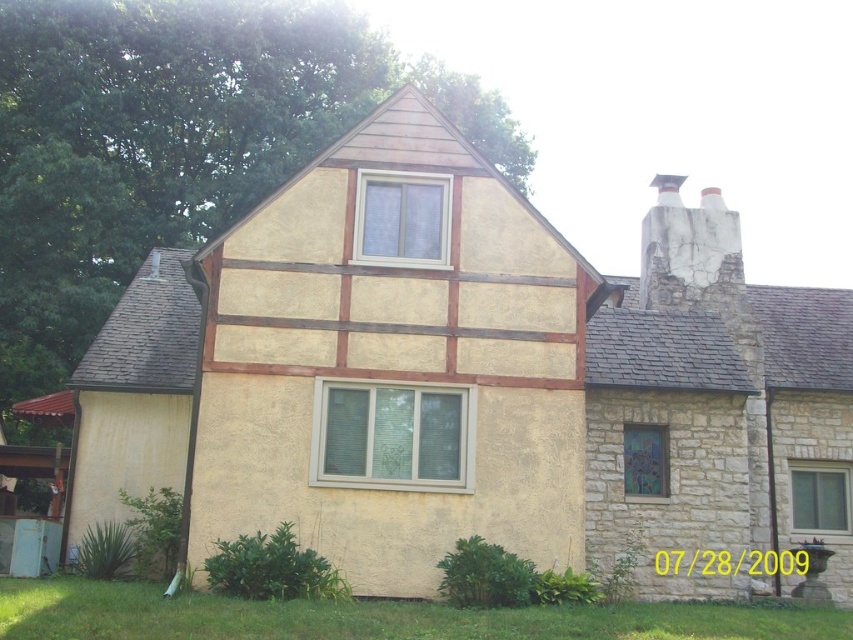
Question: In this image, where is clear glass window at center located relative to clear glass window at lower right?

Choices:
 (A) below
 (B) above

Answer: (B)

Question: Can you confirm if clear glass window at upper center is wider than clear glass window at lower right?

Choices:
 (A) no
 (B) yes

Answer: (B)

Question: Among these objects, which one is nearest to the camera?

Choices:
 (A) green grass at lower left
 (B) stained glass window at center-right

Answer: (A)

Question: Which of the following is the closest to the observer?

Choices:
 (A) (654, 618)
 (B) (631, 490)
 (C) (360, 237)
 (D) (465, 486)

Answer: (A)

Question: Is the position of clear glass window at center more distant than that of stained glass window at center-right?

Choices:
 (A) no
 (B) yes

Answer: (A)

Question: Which is farther from the stained glass window at center-right?

Choices:
 (A) clear glass window at upper center
 (B) green grass at lower left
 (C) clear glass window at lower right

Answer: (A)